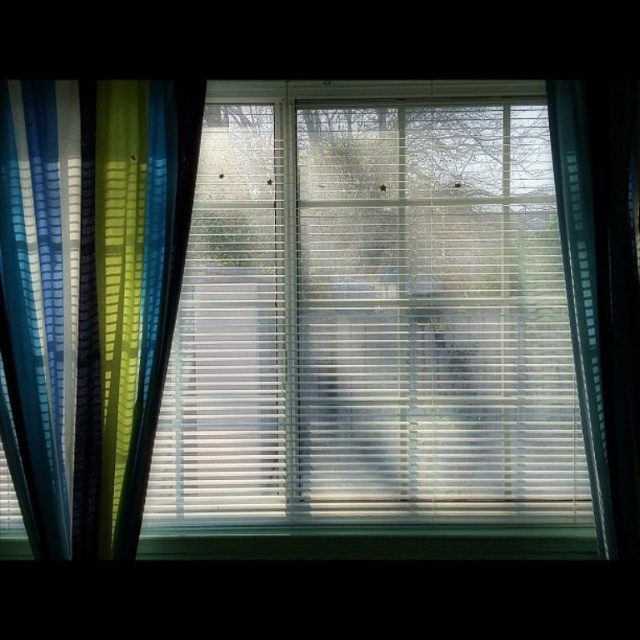
You are standing in front of the window and notice two points marked on the window. The first point is at coordinates point (419,172) and the second is at point (131,445). Which point is closer to you?

Point (419,172) is further to the viewer than point (131,445), so the second point is closer to you.

You are standing in a room and want to let more light into the space. You can adjust either the translucent plastic blinds at center or the blue striped curtain at left. Which object should you adjust to allow more light to enter the room?

The translucent plastic blinds at center is shorter than the blue striped curtain at left, so adjusting the translucent plastic blinds at center would allow more light to enter since it covers less of the window area.